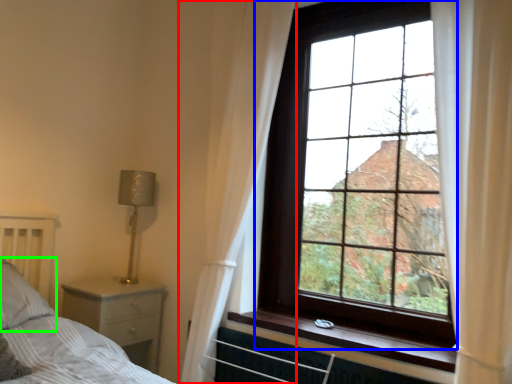
Question: Estimate the real-world distances between objects in this image. Which object is closer to curtain (highlighted by a red box), window (highlighted by a blue box) or pillow (highlighted by a green box)?

Choices:
 (A) window
 (B) pillow

Answer: (A)